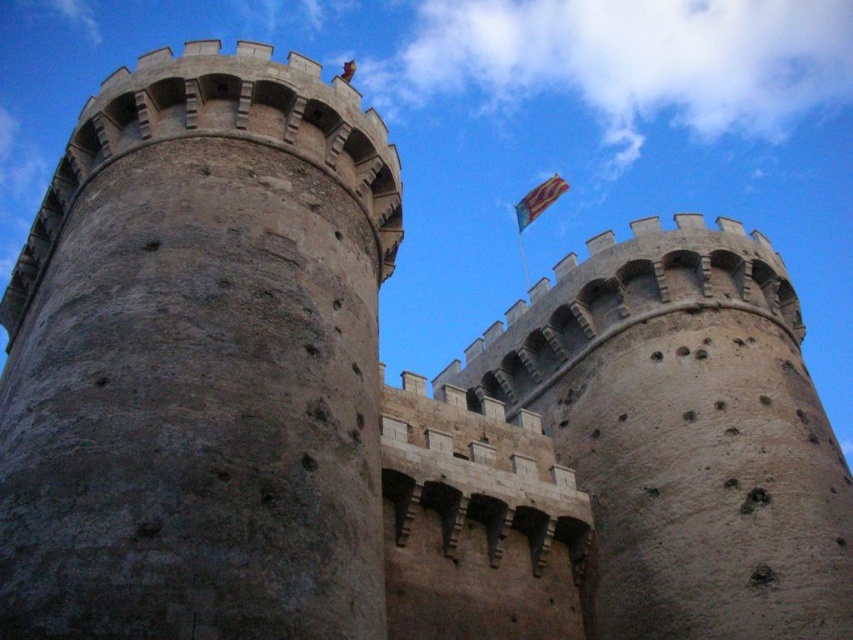
You are standing in front of the medieval castle and want to take a photo of the brown stone tower at left. To ensure the tower is centered in your photo, where should you position your camera? Please provide the coordinates based on the image grid system where the bottom left corner is the origin point.

The brown stone tower at left is located at coordinates [200,362], so you should position your camera to center the tower at those coordinates.